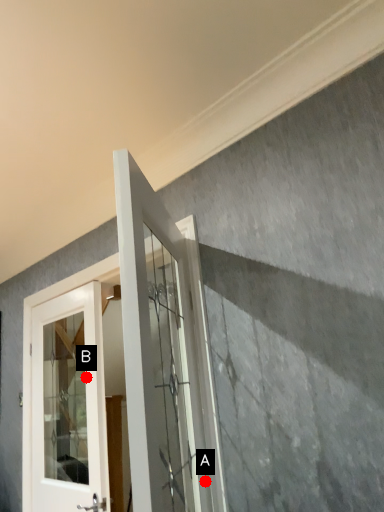
Question: Two points are circled on the image, labeled by A and B beside each circle. Which point is farther from the camera taking this photo?

Choices:
 (A) A is further
 (B) B is further

Answer: (B)